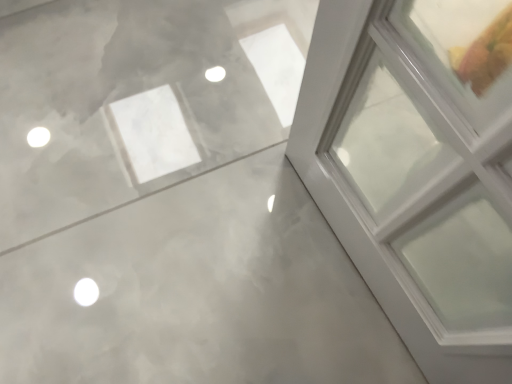
What do you see at coordinates (485, 54) in the screenshot? This screenshot has width=512, height=384. I see `yellow matte food at upper right` at bounding box center [485, 54].

The height and width of the screenshot is (384, 512). I want to click on yellow matte food at upper right, so click(485, 54).

Where is `yellow matte food at upper right`? This screenshot has width=512, height=384. yellow matte food at upper right is located at coordinates (485, 54).